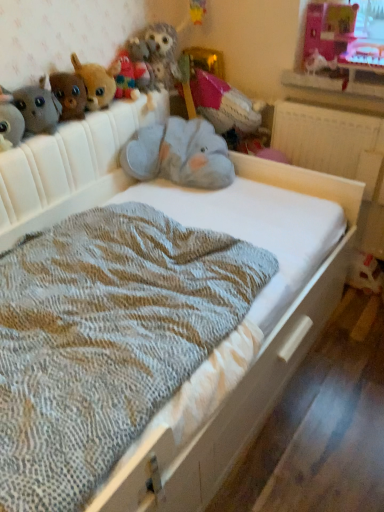
From the picture: How much space does white glossy bird at upper right, which appears as the first animal when viewed from the right, occupy horizontally?

white glossy bird at upper right, which appears as the first animal when viewed from the right, is 4.46 inches wide.

Find the location of a particular element. Image resolution: width=384 pixels, height=512 pixels. pink fabric stuffed animal at upper center, which ranks as the sixth toy in left-to-right order is located at coordinates (222, 104).

Where is `fuzzy fabric owl at upper center, the 1th animal from the left`? This screenshot has height=512, width=384. fuzzy fabric owl at upper center, the 1th animal from the left is located at coordinates (163, 53).

Is pink fabric stuffed animal at upper center, marked as the 1th toy in a right-to-left arrangement, completely or partially outside of pink fabric window screen at upper right?

Yes, pink fabric stuffed animal at upper center, marked as the 1th toy in a right-to-left arrangement, is outside of pink fabric window screen at upper right.

In the scene shown: Considering the sizes of objects pink fabric stuffed animal at upper center, marked as the 1th toy in a right-to-left arrangement, and pink fabric window screen at upper right in the image provided, who is wider, pink fabric stuffed animal at upper center, marked as the 1th toy in a right-to-left arrangement, or pink fabric window screen at upper right?

pink fabric stuffed animal at upper center, marked as the 1th toy in a right-to-left arrangement, is wider.

Can brown plush toy at upper left, which is the 4th toy in right-to-left order, be found inside gray plush elephant at center, acting as the 2th toy starting from the right?

No.

From a real-world perspective, which is physically above, gray plush elephant at center, which is the fifth toy in left-to-right order, or brown plush toy at upper left, which is the 4th toy in right-to-left order?

From a 3D spatial view, brown plush toy at upper left, which is the 4th toy in right-to-left order, is above.

From the image's perspective, is gray plush elephant at center, acting as the 2th toy starting from the right, on top of brown plush toy at upper left, the third toy when ordered from left to right?

No, from the image's perspective, gray plush elephant at center, acting as the 2th toy starting from the right, is not over brown plush toy at upper left, the third toy when ordered from left to right.

Consider the image. Between gray plush elephant at center, acting as the 2th toy starting from the right, and brown plush toy at upper left, the third toy when ordered from left to right, which one has less height?

With less height is brown plush toy at upper left, the third toy when ordered from left to right.

From the image's perspective, which one is positioned lower, brown plush toy at upper left, acting as the 3th toy starting from the right, or white glossy bird at upper right, which is counted as the 2th animal, starting from the left?

brown plush toy at upper left, acting as the 3th toy starting from the right, appears lower in the image.

Does brown plush toy at upper left, acting as the 3th toy starting from the right, have a smaller size compared to white glossy bird at upper right, which appears as the first animal when viewed from the right?

No, brown plush toy at upper left, acting as the 3th toy starting from the right, is not smaller than white glossy bird at upper right, which appears as the first animal when viewed from the right.

How distant is brown plush toy at upper left, the 4th toy when ordered from left to right, from white glossy bird at upper right, which is counted as the 2th animal, starting from the left?

They are 33.20 inches apart.

Consider the image. Considering the positions of objects brown plush toy at upper left, the 4th toy when ordered from left to right, and white glossy bird at upper right, which is counted as the 2th animal, starting from the left, in the image provided, who is more to the right, brown plush toy at upper left, the 4th toy when ordered from left to right, or white glossy bird at upper right, which is counted as the 2th animal, starting from the left,?

Positioned to the right is white glossy bird at upper right, which is counted as the 2th animal, starting from the left.

Considering the relative sizes of pink fabric stuffed animal at upper center, marked as the 1th toy in a right-to-left arrangement, and fuzzy gray plush at upper left, which is the sixth toy from right to left, in the image provided, is pink fabric stuffed animal at upper center, marked as the 1th toy in a right-to-left arrangement, bigger than fuzzy gray plush at upper left, which is the sixth toy from right to left,?

Correct, pink fabric stuffed animal at upper center, marked as the 1th toy in a right-to-left arrangement, is larger in size than fuzzy gray plush at upper left, which is the sixth toy from right to left.

Is pink fabric stuffed animal at upper center, which ranks as the sixth toy in left-to-right order, not within fuzzy gray plush at upper left, the first toy positioned from the left?

Yes, pink fabric stuffed animal at upper center, which ranks as the sixth toy in left-to-right order, is located beyond the bounds of fuzzy gray plush at upper left, the first toy positioned from the left.

Does pink fabric stuffed animal at upper center, which ranks as the sixth toy in left-to-right order, have a lesser width compared to fuzzy gray plush at upper left, which is the sixth toy from right to left?

No.

How many degrees apart are the facing directions of fuzzy fabric owl at upper center, which is the second animal in right-to-left order, and brown plush toy at upper left, the third toy when ordered from left to right?

0.00159 degrees separate the facing orientations of fuzzy fabric owl at upper center, which is the second animal in right-to-left order, and brown plush toy at upper left, the third toy when ordered from left to right.

Does fuzzy fabric owl at upper center, which is the second animal in right-to-left order, appear on the left side of brown plush toy at upper left, the third toy when ordered from left to right?

In fact, fuzzy fabric owl at upper center, which is the second animal in right-to-left order, is to the right of brown plush toy at upper left, the third toy when ordered from left to right.

Does point (165, 37) come behind point (52, 76)?

That is True.

Based on the photo, does fuzzy fabric owl at upper center, the 1th animal from the left, have a lesser width compared to brown plush toy at upper left, the third toy when ordered from left to right?

In fact, fuzzy fabric owl at upper center, the 1th animal from the left, might be wider than brown plush toy at upper left, the third toy when ordered from left to right.

Is fuzzy fabric owl at upper center, the 1th animal from the left, smaller than fuzzy gray plush at upper left, the first toy positioned from the left?

Incorrect, fuzzy fabric owl at upper center, the 1th animal from the left, is not smaller in size than fuzzy gray plush at upper left, the first toy positioned from the left.

Could you measure the distance between fuzzy fabric owl at upper center, which is the second animal in right-to-left order, and fuzzy gray plush at upper left, the first toy positioned from the left?

fuzzy fabric owl at upper center, which is the second animal in right-to-left order, is 28.24 inches away from fuzzy gray plush at upper left, the first toy positioned from the left.

Can you confirm if fuzzy fabric owl at upper center, which is the second animal in right-to-left order, is thinner than fuzzy gray plush at upper left, which is the sixth toy from right to left?

Incorrect, the width of fuzzy fabric owl at upper center, which is the second animal in right-to-left order, is not less than that of fuzzy gray plush at upper left, which is the sixth toy from right to left.

Can you confirm if fuzzy fabric owl at upper center, the 1th animal from the left, is shorter than fuzzy gray plush at upper left, which is the sixth toy from right to left?

In fact, fuzzy fabric owl at upper center, the 1th animal from the left, may be taller than fuzzy gray plush at upper left, which is the sixth toy from right to left.

Are brown plush toy at upper left, acting as the 3th toy starting from the right, and fuzzy gray plush at upper left, the first toy positioned from the left, far apart?

brown plush toy at upper left, acting as the 3th toy starting from the right, is near fuzzy gray plush at upper left, the first toy positioned from the left, not far away.

From a real-world perspective, is brown plush toy at upper left, the 4th toy when ordered from left to right, below fuzzy gray plush at upper left, which is the sixth toy from right to left?

Incorrect, from a real-world perspective, brown plush toy at upper left, the 4th toy when ordered from left to right, is higher than fuzzy gray plush at upper left, which is the sixth toy from right to left.

Is point (96, 74) behind point (2, 88)?

Yes, it is.

Is brown plush toy at upper left, acting as the 3th toy starting from the right, taller or shorter than fuzzy gray plush at upper left, which is the sixth toy from right to left?

Clearly, brown plush toy at upper left, acting as the 3th toy starting from the right, is taller compared to fuzzy gray plush at upper left, which is the sixth toy from right to left.

You are a GUI agent. You are given a task and a screenshot of the screen. Output one action in this format:
    pyautogui.click(x=<x>, y=<y>)
    Task: Click on the window screen located above the pink fabric stuffed animal at upper center, marked as the 1th toy in a right-to-left arrangement (from a real-world perspective)
    The image size is (384, 512).
    Given the screenshot: What is the action you would take?
    pyautogui.click(x=330, y=29)

Image resolution: width=384 pixels, height=512 pixels. In order to click on the 2nd toy in front of the gray plush elephant at center, which is the fifth toy in left-to-right order, starting your count from the anchor in this screenshot , I will do `click(69, 94)`.

When comparing their distances from fuzzy gray plush at upper left, which is the sixth toy from right to left, does fuzzy fabric stuffed animal at upper left, marked as the 2th toy in a left-to-right arrangement, or brown plush toy at upper left, which is the 4th toy in right-to-left order, seem closer?

fuzzy fabric stuffed animal at upper left, marked as the 2th toy in a left-to-right arrangement, is positioned closer to the anchor fuzzy gray plush at upper left, which is the sixth toy from right to left.

Considering their positions, is pink fabric stuffed animal at upper center, which ranks as the sixth toy in left-to-right order, positioned closer to gray plush elephant at center, acting as the 2th toy starting from the right, than white glossy bird at upper right, which is counted as the 2th animal, starting from the left?

pink fabric stuffed animal at upper center, which ranks as the sixth toy in left-to-right order, lies closer to gray plush elephant at center, acting as the 2th toy starting from the right, than the other object.

From the picture: From the image, which object appears to be nearer to fuzzy fabric owl at upper center, which is the second animal in right-to-left order, brown plush toy at upper left, the third toy when ordered from left to right, or white glossy bird at upper right, which is counted as the 2th animal, starting from the left?

brown plush toy at upper left, the third toy when ordered from left to right, is positioned closer to the anchor fuzzy fabric owl at upper center, which is the second animal in right-to-left order.

Estimate the real-world distances between objects in this image. Which object is closer to fuzzy gray plush at upper left, which is the sixth toy from right to left, white glossy bird at upper right, which appears as the first animal when viewed from the right, or pink fabric window screen at upper right?

white glossy bird at upper right, which appears as the first animal when viewed from the right, lies closer to fuzzy gray plush at upper left, which is the sixth toy from right to left, than the other object.

When comparing their distances from fuzzy fabric owl at upper center, the 1th animal from the left, does brown plush toy at upper left, the 4th toy when ordered from left to right, or pink fabric window screen at upper right seem closer?

brown plush toy at upper left, the 4th toy when ordered from left to right, lies closer to fuzzy fabric owl at upper center, the 1th animal from the left, than the other object.

Which object lies further to the anchor point brown plush toy at upper left, acting as the 3th toy starting from the right, white glossy bird at upper right, which appears as the first animal when viewed from the right, or fuzzy fabric owl at upper center, which is the second animal in right-to-left order?

white glossy bird at upper right, which appears as the first animal when viewed from the right.

When comparing their distances from fuzzy fabric stuffed animal at upper left, which is the fifth toy from right to left, does pink fabric window screen at upper right or pink fabric stuffed animal at upper center, marked as the 1th toy in a right-to-left arrangement, seem closer?

pink fabric stuffed animal at upper center, marked as the 1th toy in a right-to-left arrangement, lies closer to fuzzy fabric stuffed animal at upper left, which is the fifth toy from right to left, than the other object.

From the image, which object appears to be farther from fuzzy gray plush at upper left, which is the sixth toy from right to left, brown plush toy at upper left, the 4th toy when ordered from left to right, or white glossy bird at upper right, which is counted as the 2th animal, starting from the left?

white glossy bird at upper right, which is counted as the 2th animal, starting from the left, lies further to fuzzy gray plush at upper left, which is the sixth toy from right to left, than the other object.

Image resolution: width=384 pixels, height=512 pixels. I want to click on animal between brown plush toy at upper left, acting as the 3th toy starting from the right, and pink fabric stuffed animal at upper center, marked as the 1th toy in a right-to-left arrangement, so click(x=163, y=53).

In order to click on animal located between pink fabric stuffed animal at upper center, which ranks as the sixth toy in left-to-right order, and pink fabric window screen at upper right in the left-right direction in this screenshot , I will do `click(319, 63)`.

Identify the location of toy between brown plush toy at upper left, the third toy when ordered from left to right, and gray plush elephant at center, which is the fifth toy in left-to-right order. (97, 82).

The width and height of the screenshot is (384, 512). Identify the location of animal between fuzzy gray plush at upper left, the first toy positioned from the left, and white glossy bird at upper right, which appears as the first animal when viewed from the right, from left to right. (163, 53).